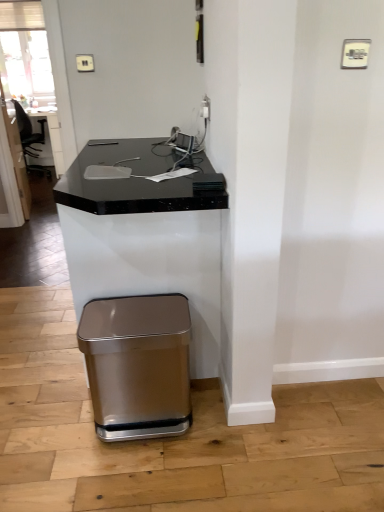
I want to click on satin metallic trash can at lower left, so click(138, 365).

Describe the element at coordinates (138, 365) in the screenshot. I see `satin metallic trash can at lower left` at that location.

What is the approximate height of satin metallic trash can at lower left?

The height of satin metallic trash can at lower left is 18.90 inches.

Locate an element on the screen. The height and width of the screenshot is (512, 384). black marble computer desk at center is located at coordinates (146, 234).

The width and height of the screenshot is (384, 512). Describe the element at coordinates (146, 234) in the screenshot. I see `black marble computer desk at center` at that location.

What is the approximate height of black marble computer desk at center?

91.43 centimeters.

Image resolution: width=384 pixels, height=512 pixels. Identify the location of satin metallic trash can at lower left. (138, 365).

Considering the positions of objects black marble computer desk at center and satin metallic trash can at lower left in the image provided, who is more to the right, black marble computer desk at center or satin metallic trash can at lower left?

Positioned to the right is satin metallic trash can at lower left.

Between black marble computer desk at center and satin metallic trash can at lower left, which one is positioned behind?

satin metallic trash can at lower left is more distant.

Is point (178, 281) more distant than point (148, 419)?

Yes, it is.

From the image's perspective, is black marble computer desk at center beneath satin metallic trash can at lower left?

No, from the image's perspective, black marble computer desk at center is not beneath satin metallic trash can at lower left.

Consider the image. From a real-world perspective, is black marble computer desk at center positioned above or below satin metallic trash can at lower left?

black marble computer desk at center is situated higher than satin metallic trash can at lower left in the real world.

Which object is wider, black marble computer desk at center or satin metallic trash can at lower left?

black marble computer desk at center is wider.

Which of these two, black marble computer desk at center or satin metallic trash can at lower left, stands taller?

Standing taller between the two is black marble computer desk at center.

Can you confirm if black marble computer desk at center is bigger than satin metallic trash can at lower left?

Indeed, black marble computer desk at center has a larger size compared to satin metallic trash can at lower left.

Looking at this image, which is correct: black marble computer desk at center is inside satin metallic trash can at lower left, or outside of it?

The correct answer is: outside.

Is the surface of black marble computer desk at center in direct contact with satin metallic trash can at lower left?

black marble computer desk at center is not next to satin metallic trash can at lower left, and they're not touching.

Is black marble computer desk at center oriented away from satin metallic trash can at lower left?

black marble computer desk at center is not turned away from satin metallic trash can at lower left.

This screenshot has width=384, height=512. I want to click on waste container that is below the black marble computer desk at center (from the image's perspective), so click(x=138, y=365).

From the picture: Which is more to the right, satin metallic trash can at lower left or black marble computer desk at center?

Positioned to the right is satin metallic trash can at lower left.

Which object is closer to the camera, satin metallic trash can at lower left or black marble computer desk at center?

black marble computer desk at center is in front.

Does point (169, 383) appear closer or farther from the camera than point (102, 284)?

Point (169, 383) appears to be closer to the viewer than point (102, 284).

From the image's perspective, which one is positioned higher, satin metallic trash can at lower left or black marble computer desk at center?

black marble computer desk at center.

From a real-world perspective, does satin metallic trash can at lower left sit lower than black marble computer desk at center?

Yes.

Does satin metallic trash can at lower left have a greater width compared to black marble computer desk at center?

No, satin metallic trash can at lower left is not wider than black marble computer desk at center.

Considering the sizes of objects satin metallic trash can at lower left and black marble computer desk at center in the image provided, who is taller, satin metallic trash can at lower left or black marble computer desk at center?

With more height is black marble computer desk at center.

Which of these two, satin metallic trash can at lower left or black marble computer desk at center, is bigger?

Bigger between the two is black marble computer desk at center.

Is satin metallic trash can at lower left not inside black marble computer desk at center?

Actually, satin metallic trash can at lower left is at least partially inside black marble computer desk at center.

Would you consider satin metallic trash can at lower left to be distant from black marble computer desk at center?

No, satin metallic trash can at lower left is not far away from black marble computer desk at center.

Could you tell me if satin metallic trash can at lower left is facing black marble computer desk at center?

Yes, satin metallic trash can at lower left is facing black marble computer desk at center.

How different are the orientations of satin metallic trash can at lower left and black marble computer desk at center in degrees?

There is a 0.000459-degree angle between the facing directions of satin metallic trash can at lower left and black marble computer desk at center.

The width and height of the screenshot is (384, 512). Identify the location of computer desk above the satin metallic trash can at lower left (from a real-world perspective). (146, 234).

The height and width of the screenshot is (512, 384). I want to click on waste container behind the black marble computer desk at center, so click(138, 365).

There is a satin metallic trash can at lower left. At what (x,y) coordinates should I click in order to perform the action: click on computer desk above it (from a real-world perspective). Please return your answer as a coordinate pair (x, y). The height and width of the screenshot is (512, 384). Looking at the image, I should click on pos(146,234).